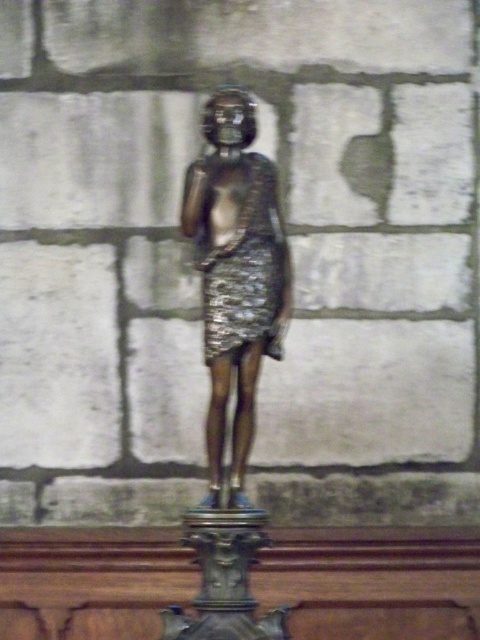
Is shiny bronze statue at center above shiny metallic dress at center?

Correct, shiny bronze statue at center is located above shiny metallic dress at center.

Is shiny bronze statue at center smaller than shiny metallic dress at center?

Incorrect, shiny bronze statue at center is not smaller in size than shiny metallic dress at center.

Is point (243, 225) less distant than point (223, 252)?

No, it is behind (223, 252).

Where is `shiny bronze statue at center`? shiny bronze statue at center is located at coordinates (236, 273).